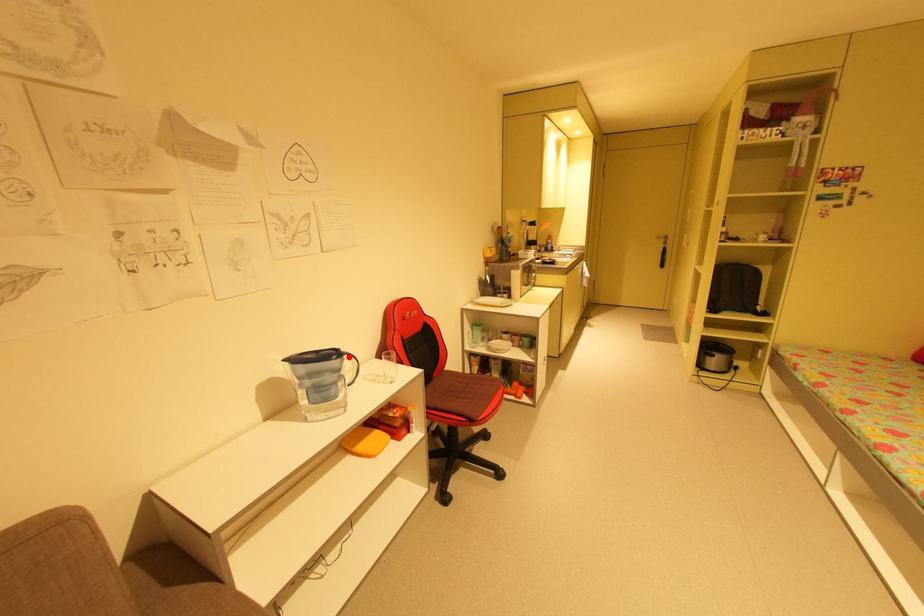
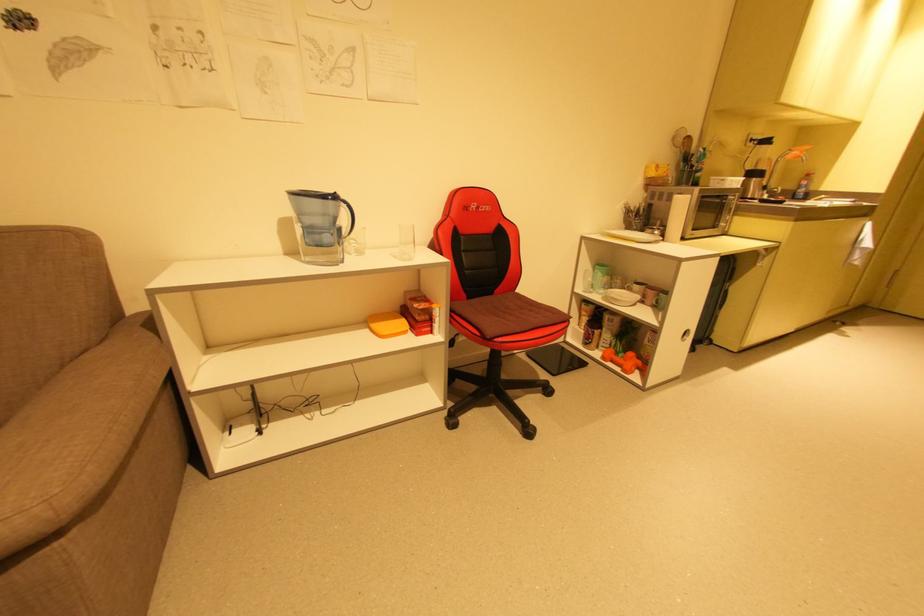
The point at the highlighted location is marked in the first image. Where is the corresponding point in the second image?

(346, 204)